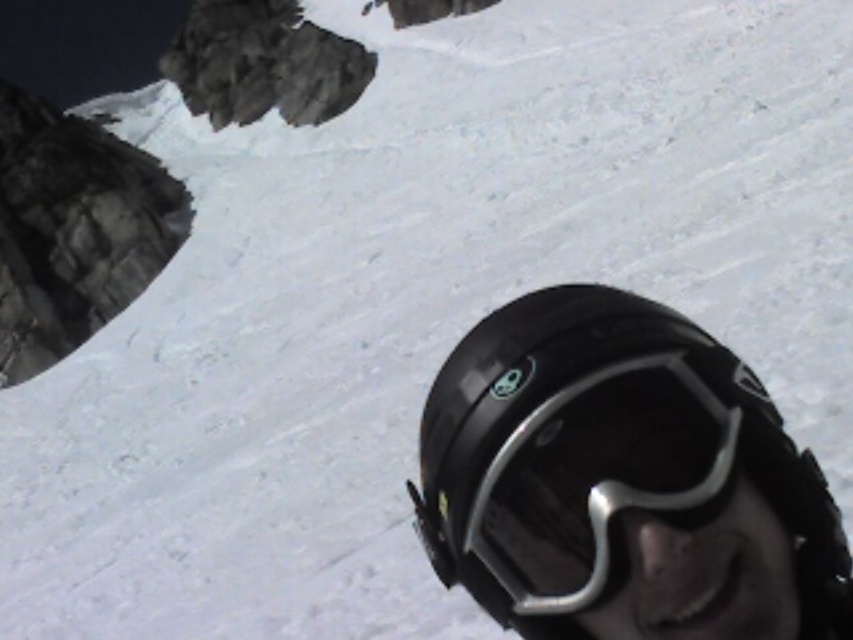
Between point (469, 392) and point (700, 380), which one is positioned behind?

The point (469, 392) is behind.

Who is more forward, (x=619, y=468) or (x=548, y=460)?

Positioned in front is point (x=619, y=468).

Identify the location of black matte helmet at lower right. (622, 481).